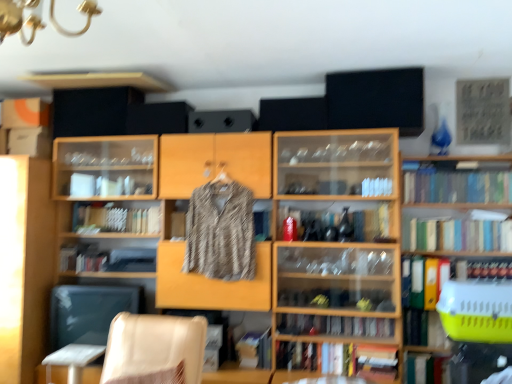
The width and height of the screenshot is (512, 384). In order to click on multicolored file folders at right, the 4th book in the top-to-bottom sequence in this screenshot , I will do `click(423, 281)`.

The height and width of the screenshot is (384, 512). Describe the element at coordinates (25, 264) in the screenshot. I see `wooden cabinet at left, marked as the 3th shelf in a right-to-left arrangement` at that location.

This screenshot has height=384, width=512. What do you see at coordinates (154, 349) in the screenshot? I see `beige leather chair at lower left` at bounding box center [154, 349].

This screenshot has height=384, width=512. Describe the element at coordinates (457, 235) in the screenshot. I see `green hardcover book at right, the second book positioned from the top` at that location.

Describe the element at coordinates (338, 363) in the screenshot. I see `hardcover book at lower center, the 2th book when ordered from bottom to top` at that location.

In order to face green matte bookshelf at right, acting as the 8th book starting from the bottom, should I rotate leftwards or rightwards?

Rotate right and turn 25.600 degrees.

Locate an element on the screen. Image resolution: width=512 pixels, height=384 pixels. patterned fabric shirt at center, which is the second shelf from right to left is located at coordinates (170, 213).

Can you tell me how much green matte book at lower right, which ranks as the 5th book in top-to-bottom order, and green matte bookshelf at right, acting as the 8th book starting from the bottom, differ in facing direction?

0.135 degrees separate the facing orientations of green matte book at lower right, which ranks as the 5th book in top-to-bottom order, and green matte bookshelf at right, acting as the 8th book starting from the bottom.

Would you say green matte book at lower right, which ranks as the fourth book in bottom-to-top order, is inside or outside green matte bookshelf at right, acting as the 8th book starting from the bottom?

green matte book at lower right, which ranks as the fourth book in bottom-to-top order, is not enclosed by green matte bookshelf at right, acting as the 8th book starting from the bottom.

Is green matte book at lower right, which ranks as the fourth book in bottom-to-top order, positioned before green matte bookshelf at right, acting as the 8th book starting from the bottom?

Yes, it is in front of green matte bookshelf at right, acting as the 8th book starting from the bottom.

From a real-world perspective, is green matte book at lower right, which ranks as the fourth book in bottom-to-top order, physically above green matte bookshelf at right, acting as the 1th book starting from the top?

Actually, green matte book at lower right, which ranks as the fourth book in bottom-to-top order, is physically below green matte bookshelf at right, acting as the 1th book starting from the top, in the real world.

Considering the sizes of hardcover book at right, arranged as the 3th book when viewed from the top, and striped fabric shirt at center in the image, is hardcover book at right, arranged as the 3th book when viewed from the top, wider or thinner than striped fabric shirt at center?

In the image, hardcover book at right, arranged as the 3th book when viewed from the top, appears to be more narrow than striped fabric shirt at center.

Considering the sizes of objects hardcover book at right, which is the sixth book from bottom to top, and striped fabric shirt at center in the image provided, who is smaller, hardcover book at right, which is the sixth book from bottom to top, or striped fabric shirt at center?

hardcover book at right, which is the sixth book from bottom to top.

From a real-world perspective, who is located lower, hardcover book at right, which is the sixth book from bottom to top, or striped fabric shirt at center?

hardcover book at right, which is the sixth book from bottom to top.

Between striped fabric shirt at center and green matte bookshelf at right, acting as the 1th book starting from the top, which one has smaller width?

striped fabric shirt at center is thinner.

From the image's perspective, which is below, striped fabric shirt at center or green matte bookshelf at right, acting as the 1th book starting from the top?

striped fabric shirt at center.

Is striped fabric shirt at center aimed at green matte bookshelf at right, acting as the 1th book starting from the top?

No.

Between green hardcover book at right, which is the 7th book from bottom to top, and green matte book at lower right, the eighth book viewed from the top, which one has smaller size?

With smaller size is green matte book at lower right, the eighth book viewed from the top.

Which is more to the right, green hardcover book at right, which is the 7th book from bottom to top, or green matte book at lower right, the eighth book viewed from the top?

From the viewer's perspective, green hardcover book at right, which is the 7th book from bottom to top, appears more on the right side.

At what (x,y) coordinates should I click in order to perform the action: click on the 1st book in front of the green hardcover book at right, which is the 7th book from bottom to top. Please return your answer as a coordinate pair (x, y). Image resolution: width=512 pixels, height=384 pixels. Looking at the image, I should click on (426, 369).

Is green hardcover book at right, which is the 7th book from bottom to top, surrounding green matte book at lower right, the first book from the bottom?

No, green matte book at lower right, the first book from the bottom, is not a part of green hardcover book at right, which is the 7th book from bottom to top.

Can you confirm if wooden bookcase at center is bigger than yellow plastic pet carrier at right, which is the 3th shelf from left to right?

Yes, wooden bookcase at center is bigger than yellow plastic pet carrier at right, which is the 3th shelf from left to right.

Who is taller, wooden bookcase at center or yellow plastic pet carrier at right, which is the 3th shelf from left to right?

wooden bookcase at center.

Does point (357, 196) lie in front of point (500, 368)?

No, (357, 196) is behind (500, 368).

How far apart are wooden bookcase at center and yellow plastic pet carrier at right, which is the 3th shelf from left to right?

A: A distance of 33.74 inches exists between wooden bookcase at center and yellow plastic pet carrier at right, which is the 3th shelf from left to right.

Relative to green hardcover book at right, which is the 7th book from bottom to top, is striped fabric shirt at center in front or behind?

In the image, striped fabric shirt at center appears in front of green hardcover book at right, which is the 7th book from bottom to top.

From the image's perspective, which book is the 1st one below the striped fabric shirt at center? Please provide its 2D coordinates.

[(457, 235)]

From the image's perspective, relative to green hardcover book at right, the second book positioned from the top, is striped fabric shirt at center above or below?

From the image's perspective, striped fabric shirt at center appears above green hardcover book at right, the second book positioned from the top.

Would you say striped fabric shirt at center is to the left or to the right of green hardcover book at right, which is the 7th book from bottom to top, in the picture?

striped fabric shirt at center is positioned on green hardcover book at right, which is the 7th book from bottom to top,'s left side.

From the image's perspective, is hardcover book at right, which is the sixth book from bottom to top, above or below patterned fabric shirt at center, which is the second shelf from right to left?

Based on their image positions, hardcover book at right, which is the sixth book from bottom to top, is located beneath patterned fabric shirt at center, which is the second shelf from right to left.

Can you confirm if hardcover book at right, arranged as the 3th book when viewed from the top, is taller than patterned fabric shirt at center, which is the second shelf from right to left?

No, hardcover book at right, arranged as the 3th book when viewed from the top, is not taller than patterned fabric shirt at center, which is the second shelf from right to left.

Consider the image. Considering the positions of objects hardcover book at right, which is the sixth book from bottom to top, and patterned fabric shirt at center, which appears as the 2th shelf when viewed from the left, in the image provided, who is more to the right, hardcover book at right, which is the sixth book from bottom to top, or patterned fabric shirt at center, which appears as the 2th shelf when viewed from the left,?

From the viewer's perspective, hardcover book at right, which is the sixth book from bottom to top, appears more on the right side.

Is point (474, 263) behind point (181, 202)?

That is False.

You are a GUI agent. You are given a task and a screenshot of the screen. Output one action in this format:
    pyautogui.click(x=<x>, y=<y>)
    Task: Click on the 2nd book to the right when counting from the green matte book at lower right, which ranks as the 5th book in top-to-bottom order
    Image resolution: width=512 pixels, height=384 pixels.
    Given the screenshot: What is the action you would take?
    click(x=455, y=184)

This screenshot has height=384, width=512. I want to click on the 1st book in front of the striped fabric shirt at center, so click(x=484, y=270).

Looking at the image, which one is located closer to hardcover book at lower center, the 2th book when ordered from bottom to top, patterned fabric shirt at center, which appears as the 2th shelf when viewed from the left, or hardcover book at center, the third book when ordered from bottom to top?

hardcover book at center, the third book when ordered from bottom to top.

Based on their spatial positions, is hardcover book at center, the 6th book when ordered from top to bottom, or green matte book at lower right, the first book from the bottom, further from hardcover book at right, which is the sixth book from bottom to top?

Based on the image, hardcover book at center, the 6th book when ordered from top to bottom, appears to be further to hardcover book at right, which is the sixth book from bottom to top.

Which object lies nearer to the anchor point wooden bookcase at center, hardcover book at lower center, the seventh book when ordered from top to bottom, or hardcover book at right, which is the sixth book from bottom to top?

hardcover book at lower center, the seventh book when ordered from top to bottom, lies closer to wooden bookcase at center than the other object.

When comparing their distances from hardcover book at center, the third book when ordered from bottom to top, does white plastic table at lower left or striped fabric shirt at center seem closer?

The object closer to hardcover book at center, the third book when ordered from bottom to top, is striped fabric shirt at center.

When comparing their distances from hardcover book at right, arranged as the 3th book when viewed from the top, does multicolored file folders at right, the 4th book in the top-to-bottom sequence, or green matte bookshelf at right, acting as the 1th book starting from the top, seem further?

green matte bookshelf at right, acting as the 1th book starting from the top, lies further to hardcover book at right, arranged as the 3th book when viewed from the top, than the other object.

In the scene shown: From the image, which object appears to be nearer to beige leather chair at lower left, striped fabric shirt at center or green matte bookshelf at right, acting as the 8th book starting from the bottom?

The object closer to beige leather chair at lower left is striped fabric shirt at center.

When comparing their distances from green matte book at lower right, which ranks as the fourth book in bottom-to-top order, does beige leather chair at lower left or hardcover book at right, arranged as the 3th book when viewed from the top, seem further?

Among the two, beige leather chair at lower left is located further to green matte book at lower right, which ranks as the fourth book in bottom-to-top order.

From the image, which object appears to be farther from green matte bookshelf at right, acting as the 1th book starting from the top, green hardcover book at right, the second book positioned from the top, or white plastic table at lower left?

white plastic table at lower left is further to green matte bookshelf at right, acting as the 1th book starting from the top.

Image resolution: width=512 pixels, height=384 pixels. Find the location of `shelf located between wooden cabinet at left, positioned as the first shelf in left-to-right order, and multicolored file folders at right, marked as the fifth book in a bottom-to-top arrangement, in the left-right direction`. shelf located between wooden cabinet at left, positioned as the first shelf in left-to-right order, and multicolored file folders at right, marked as the fifth book in a bottom-to-top arrangement, in the left-right direction is located at coordinates (170, 213).

Find the location of a particular element. bookcase between white plastic table at lower left and hardcover book at center, the 6th book when ordered from top to bottom, from left to right is located at coordinates (294, 241).

At what (x,y) coordinates should I click in order to perform the action: click on chair between white plastic table at lower left and green matte book at lower right, which ranks as the 5th book in top-to-bottom order, in the horizontal direction. Please return your answer as a coordinate pair (x, y). Image resolution: width=512 pixels, height=384 pixels. Looking at the image, I should click on (154, 349).

You are a GUI agent. You are given a task and a screenshot of the screen. Output one action in this format:
    pyautogui.click(x=<x>, y=<y>)
    Task: Click on the chair between wooden cabinet at left, positioned as the first shelf in left-to-right order, and hardcover book at lower center, the 2th book when ordered from bottom to top, from left to right
    The height and width of the screenshot is (384, 512).
    Given the screenshot: What is the action you would take?
    pyautogui.click(x=154, y=349)